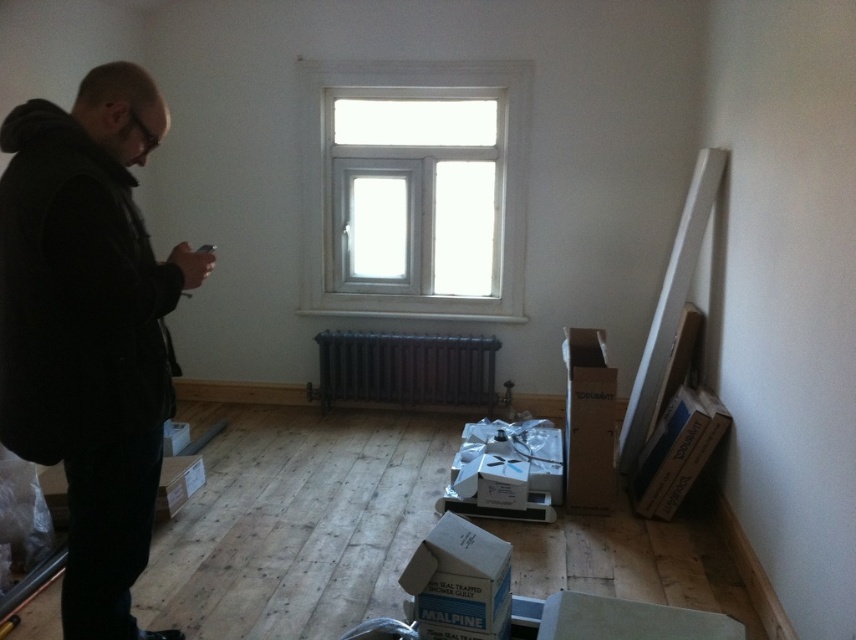
Question: Which object is positioned closest to the brown cardboard box at lower right?

Choices:
 (A) black matte jacket at left
 (B) white plastic window at upper center
 (C) white cardboard box at lower left
 (D) blue cardboard box at lower center

Answer: (D)

Question: Does white plastic window at upper center have a greater width compared to black cast iron radiator at center?

Choices:
 (A) no
 (B) yes

Answer: (B)

Question: Can you confirm if white plastic window at upper center is thinner than blue cardboard box at lower center?

Choices:
 (A) no
 (B) yes

Answer: (A)

Question: Among these objects, which one is farthest from the camera?

Choices:
 (A) brown cardboard box at lower right
 (B) white plastic window at upper center
 (C) blue cardboard box at lower center
 (D) black cast iron radiator at center

Answer: (D)

Question: Is white plastic window at upper center thinner than white cardboard box at lower left?

Choices:
 (A) no
 (B) yes

Answer: (A)

Question: Which object appears closest to the camera in this image?

Choices:
 (A) white cardboard box at lower left
 (B) black cast iron radiator at center
 (C) blue cardboard box at lower center
 (D) white plastic window at upper center

Answer: (C)